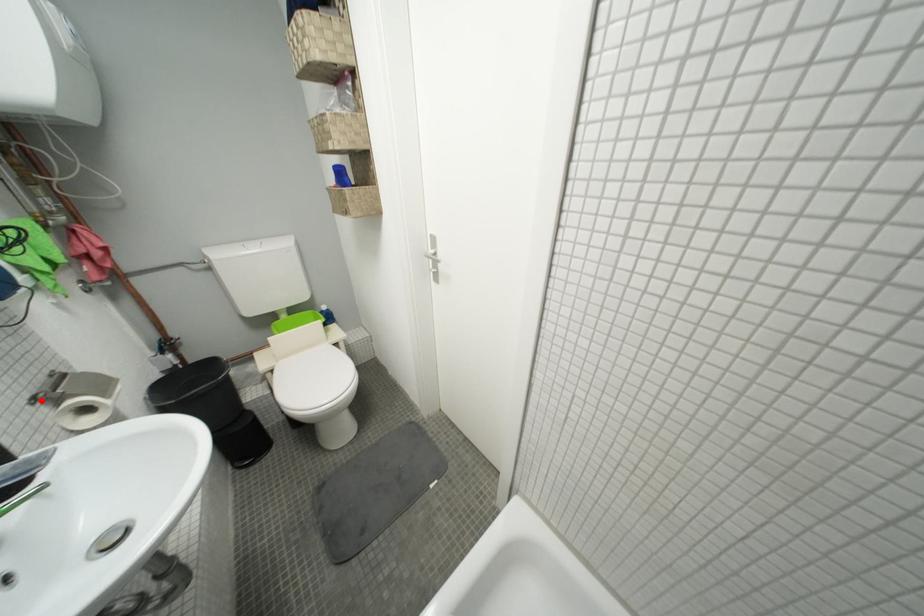
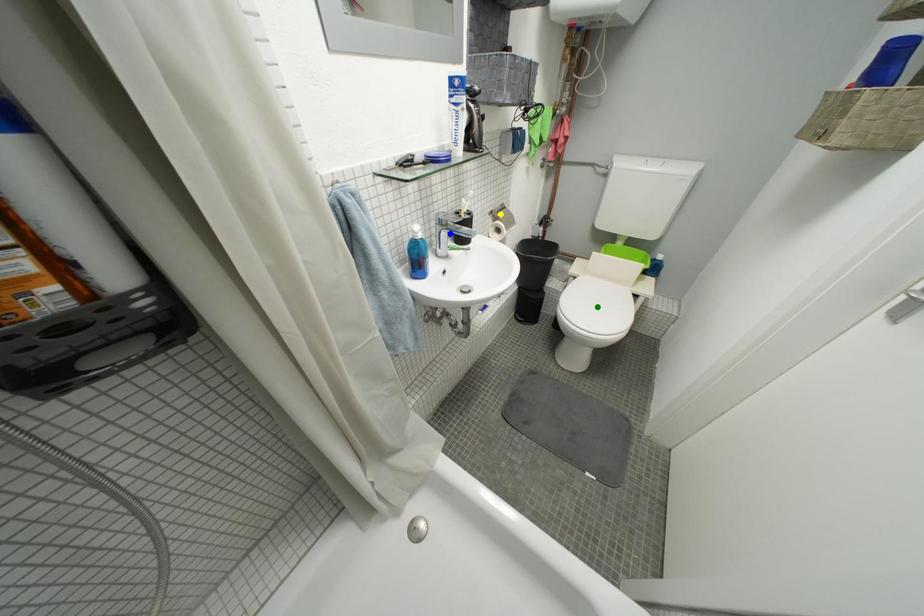
Question: I am providing you with two images of the same scene from different viewpoints. A red point is marked on the first image. You are given multiple points on the second image. Can you choose the point in image 2 that corresponds to the point in image 1?

Choices:
 (A) green point
 (B) yellow point
 (C) blue point

Answer: (B)